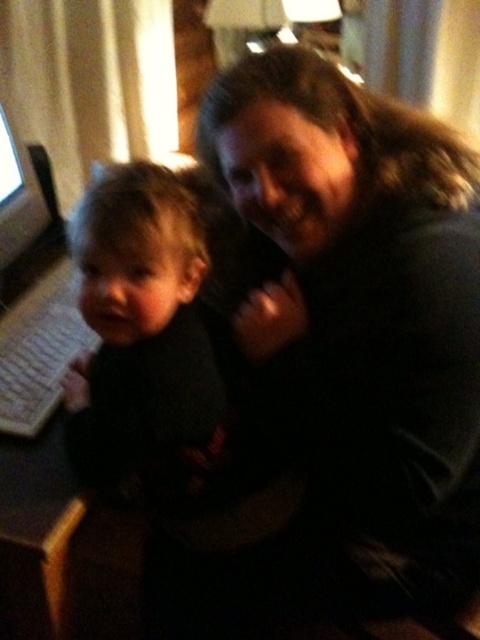
Question: Estimate the real-world distances between objects in this image. Which object is closer to the dark gray sweater at center?

Choices:
 (A) matte black monitor at left
 (B) dark matte clothing at center

Answer: (B)

Question: Does dark gray sweater at center appear on the left side of dark matte clothing at center?

Choices:
 (A) no
 (B) yes

Answer: (A)

Question: Which point is farther to the camera?

Choices:
 (A) dark gray sweater at center
 (B) dark matte clothing at center

Answer: (B)

Question: Can you confirm if dark gray sweater at center is positioned to the right of dark matte clothing at center?

Choices:
 (A) yes
 (B) no

Answer: (A)

Question: Considering the real-world distances, which object is farthest from the dark gray sweater at center?

Choices:
 (A) matte black monitor at left
 (B) dark matte clothing at center

Answer: (A)

Question: Can you confirm if dark matte clothing at center is positioned to the right of matte black monitor at left?

Choices:
 (A) no
 (B) yes

Answer: (B)